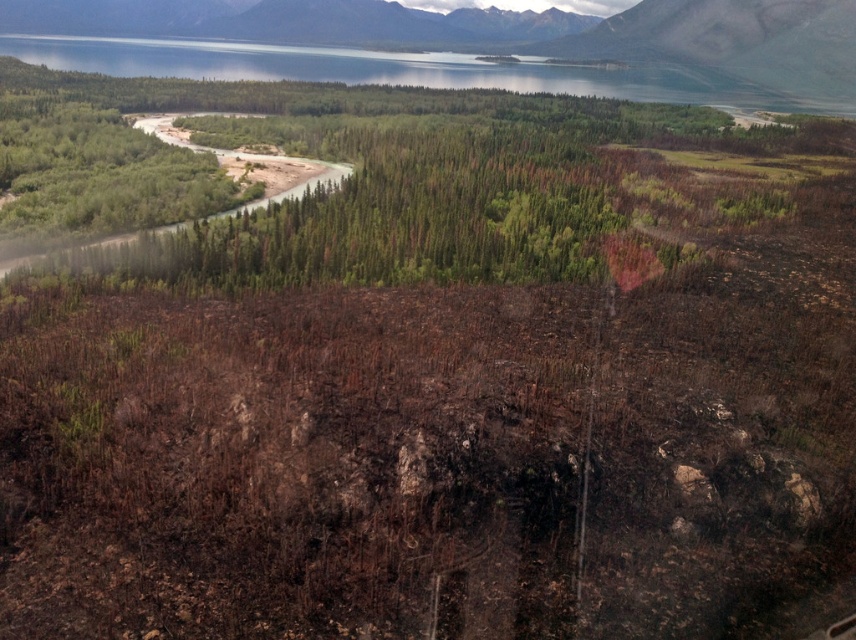
You are a firefighter assessing the damage from an aerial perspective. You observe the green matte forest at upper center and the brown textured ground at upper center. Which of these two areas is higher in elevation?

The green matte forest at upper center is taller than the brown textured ground at upper center, so the green matte forest at upper center is higher in elevation.

You are a firefighter using a drone to survey the fire damage. The drone is currently at the center of the scorched earth area. You need to locate the green matte forest at upper center. In which direction should you direct the drone to move to reach it?

The green matte forest at upper center is located at point [399,182]. Since the drone is at the center of the scorched earth area, which is likely the central point of the image, moving towards the upper center direction would guide the drone towards the green matte forest at upper center.